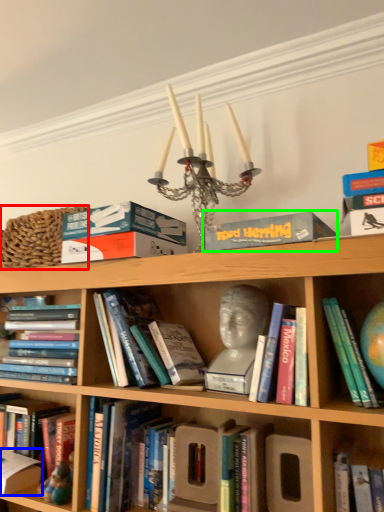
Question: Considering the real-world distances, which object is farthest from basket (highlighted by a red box)? paperback book (highlighted by a blue box) or paperback book (highlighted by a green box)?

Choices:
 (A) paperback book
 (B) paperback book

Answer: (A)